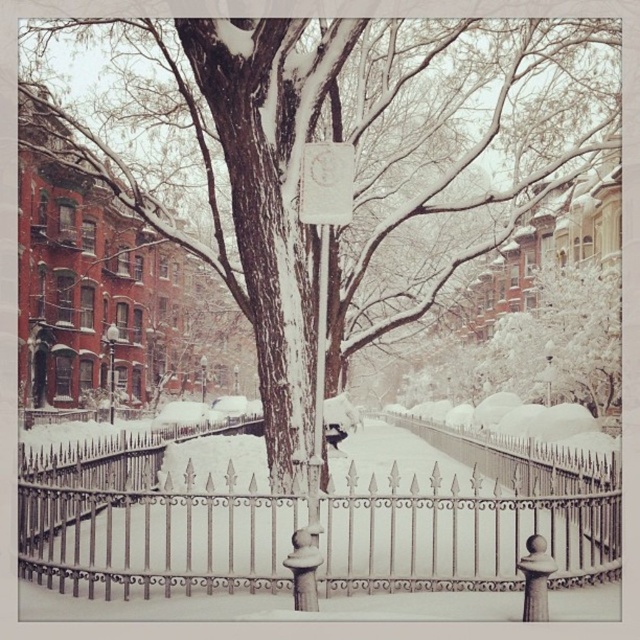
You are standing in front of the winter scene and want to take a photo of both the tree and the streetlamp. The points you are focusing on are point (410,49) and point (326,262). Which point should you focus on to ensure both are in focus?

You should focus on point (410,49) because it is closer to the camera than point (326,262), ensuring both are in focus.

You are a delivery person who needs to attach a package label to either the white paper at center or the white matte sign at center. Which object would you choose if you want to ensure the label is clearly visible and not covered by the other object?

The white paper at center is larger in size than the white matte sign at center, so attaching the package label to the white paper at center would ensure it is clearly visible and not covered by the smaller white matte sign at center.